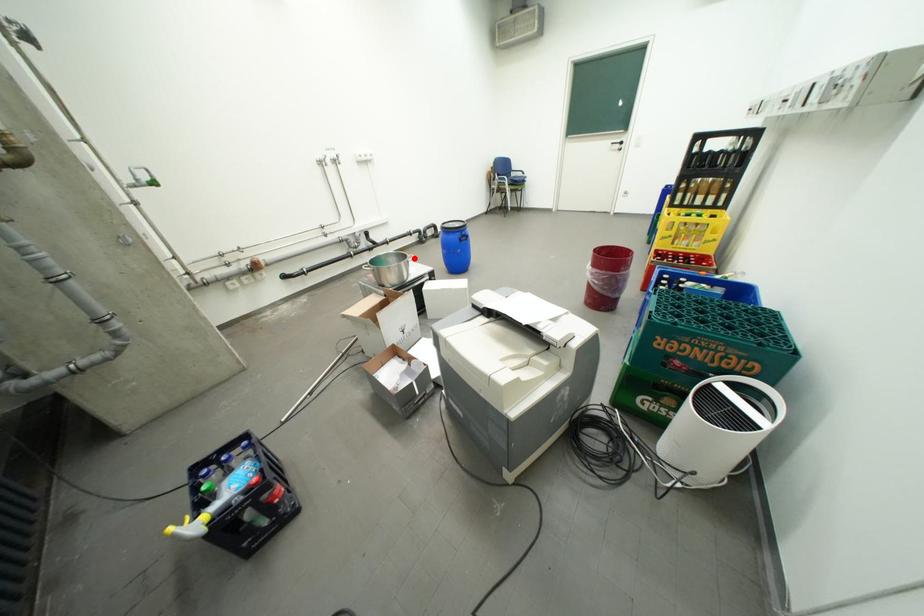
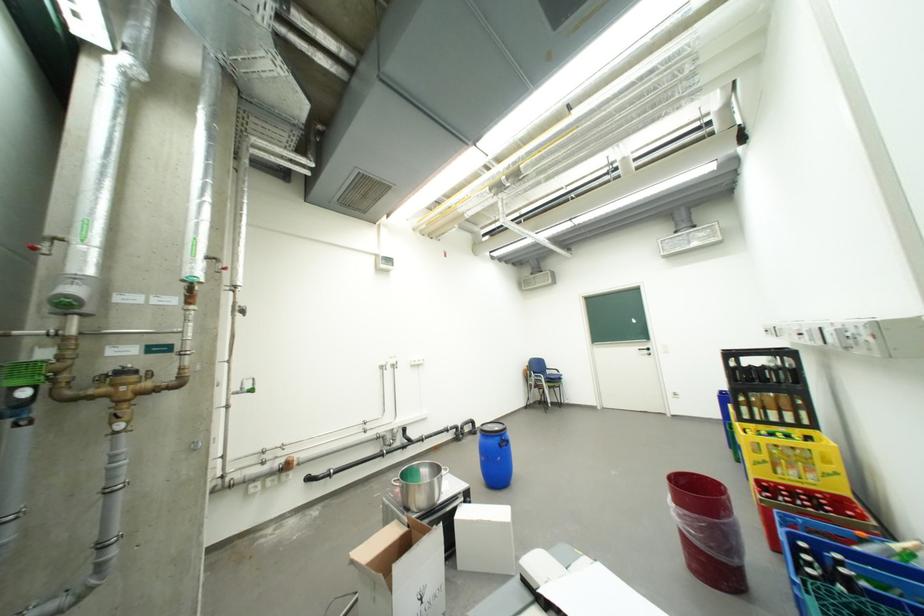
In the second image, find the point that corresponds to the highlighted location in the first image.

(447, 471)